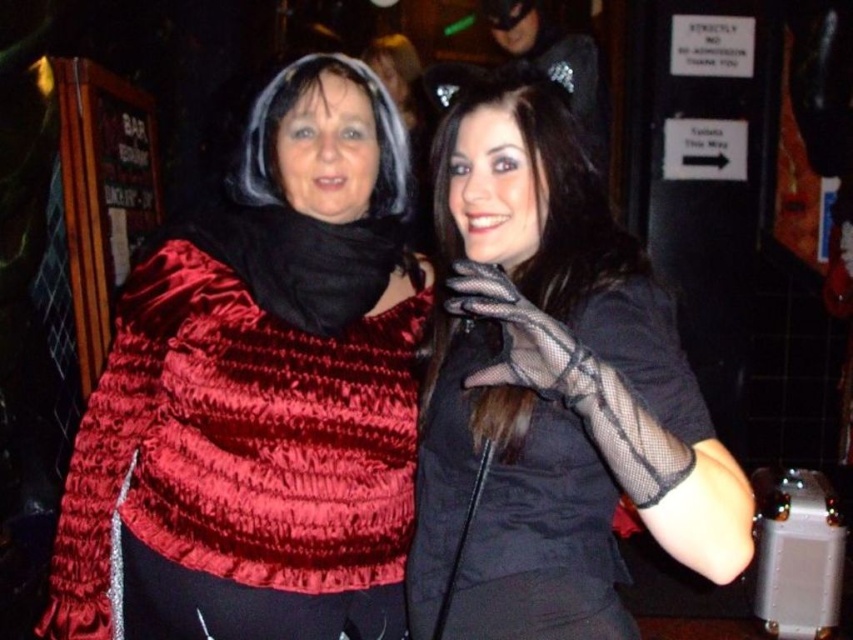
Question: Which object appears farthest from the camera in this image?

Choices:
 (A) black mesh gloves at center
 (B) velvet red cape at upper left

Answer: (B)

Question: Which of the following is the farthest from the observer?

Choices:
 (A) (543, 499)
 (B) (187, 346)

Answer: (B)

Question: Can you confirm if velvet red cape at upper left is positioned to the right of black mesh gloves at center?

Choices:
 (A) no
 (B) yes

Answer: (A)

Question: Does velvet red cape at upper left appear on the right side of black mesh gloves at center?

Choices:
 (A) yes
 (B) no

Answer: (B)

Question: Considering the relative positions of velvet red cape at upper left and black mesh gloves at center in the image provided, where is velvet red cape at upper left located with respect to black mesh gloves at center?

Choices:
 (A) above
 (B) below

Answer: (B)